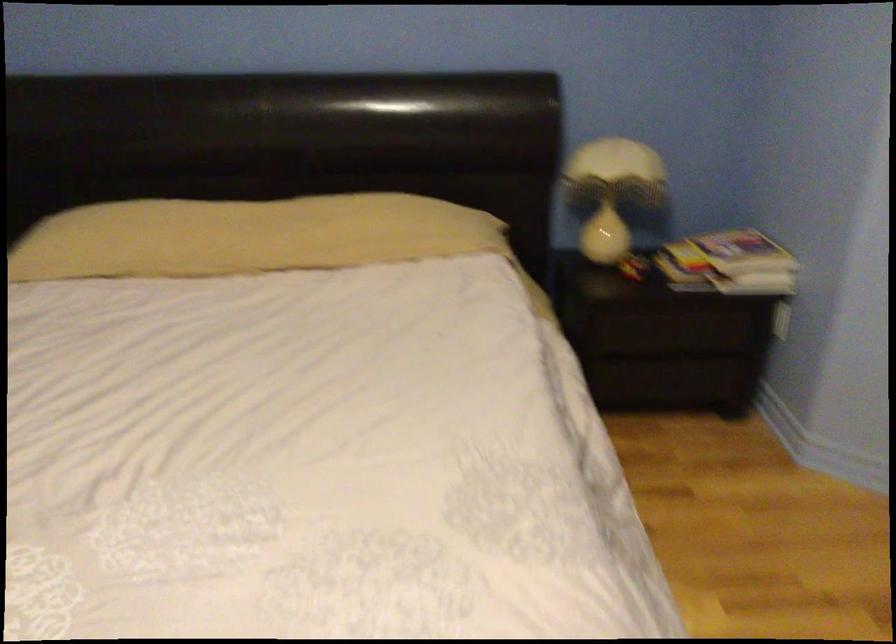
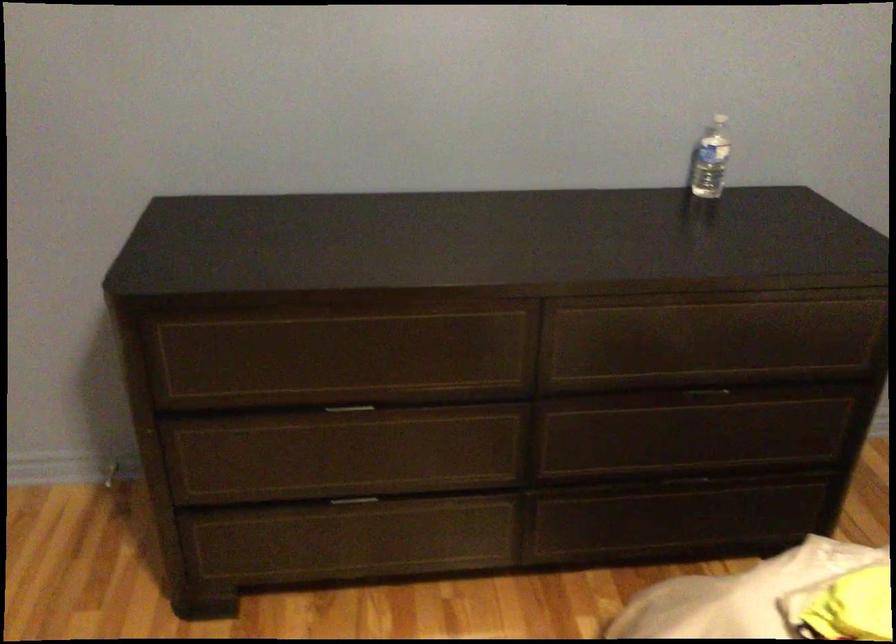
First-person continuous shooting, in which direction is the camera rotating?

The camera's rotation is toward left-down.